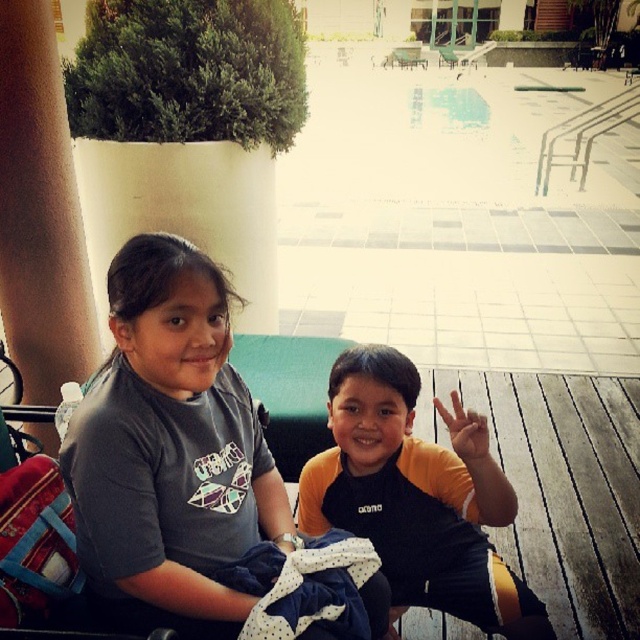
Question: Which point is farther to the camera?

Choices:
 (A) (422, 451)
 (B) (184, 429)
 (C) (388, 64)

Answer: (C)

Question: Does gray cotton shirt at center come behind yellow-orange swimwear at center?

Choices:
 (A) no
 (B) yes

Answer: (A)

Question: In this image, where is gray cotton shirt at center located relative to yellow-orange swimwear at center?

Choices:
 (A) below
 (B) above

Answer: (B)

Question: Among these objects, which one is farthest from the camera?

Choices:
 (A) gray cotton shirt at center
 (B) wooden bench at center

Answer: (B)

Question: Which object is the closest to the yellow-orange swimwear at center?

Choices:
 (A) wooden bench at center
 (B) gray cotton shirt at center

Answer: (B)

Question: Does yellow-orange swimwear at center have a larger size compared to wooden bench at center?

Choices:
 (A) no
 (B) yes

Answer: (A)